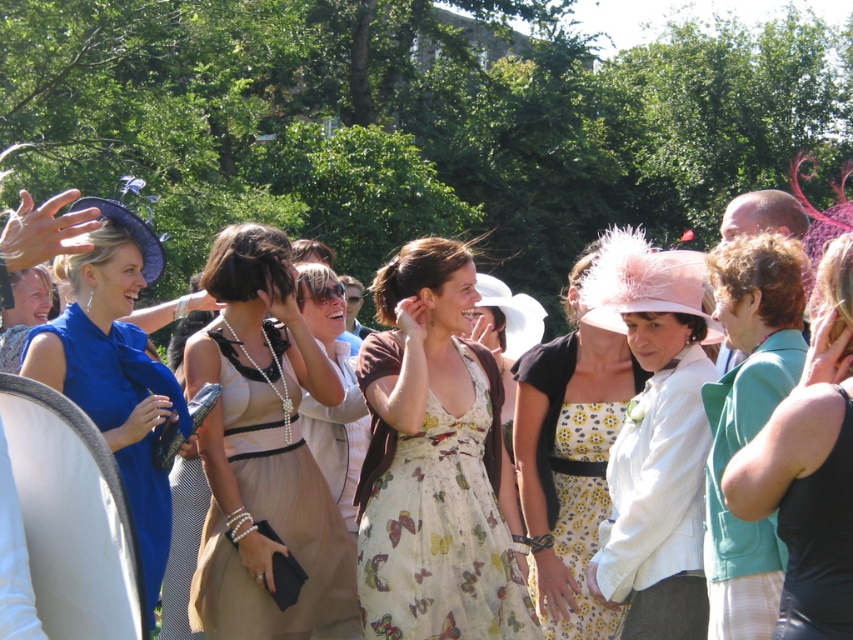
Question: Does matte blue dress at left have a lesser width compared to yellow floral fabric dress at center?

Choices:
 (A) no
 (B) yes

Answer: (A)

Question: Which object is positioned farthest from the butterfly-patterned fabric dress at center?

Choices:
 (A) floral print dress at center
 (B) black satin dress at lower right

Answer: (B)

Question: Which point is closer to the camera taking this photo?

Choices:
 (A) (322, 552)
 (B) (439, 518)

Answer: (B)

Question: Does matte blue dress at left come in front of yellow floral fabric dress at center?

Choices:
 (A) yes
 (B) no

Answer: (A)

Question: Does matte white hat at center have a smaller size compared to black satin dress at lower right?

Choices:
 (A) no
 (B) yes

Answer: (A)

Question: Among these points, which one is farthest from the camera?

Choices:
 (A) (827, 508)
 (B) (328, 451)
 (C) (579, 422)

Answer: (B)